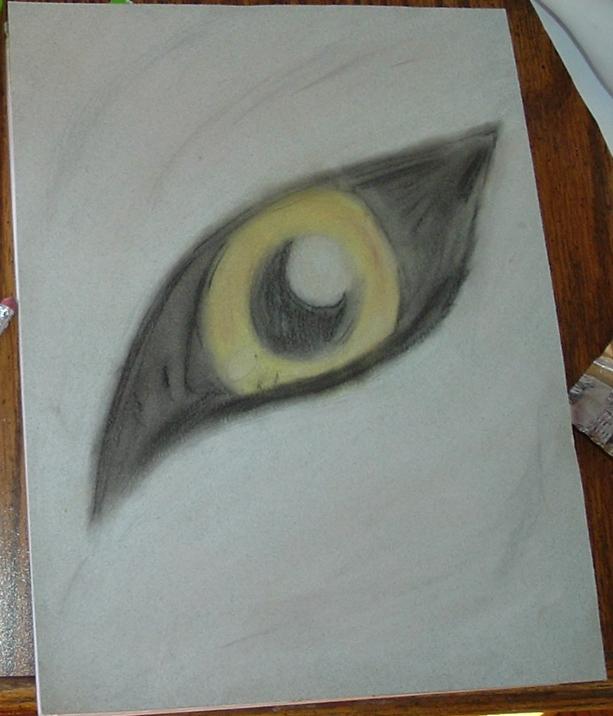
Find the location of `table`. table is located at coordinates 585,266.